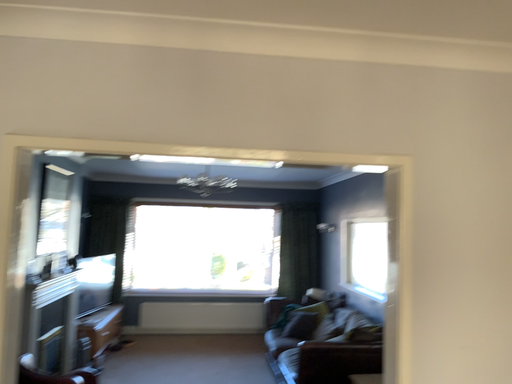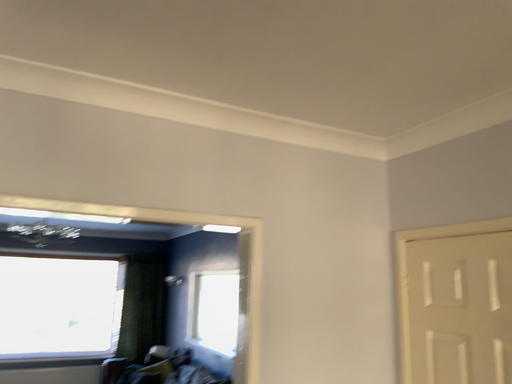
Question: Which way did the camera rotate in the video?

Choices:
 (A) rotated downward
 (B) rotated upward

Answer: (B)